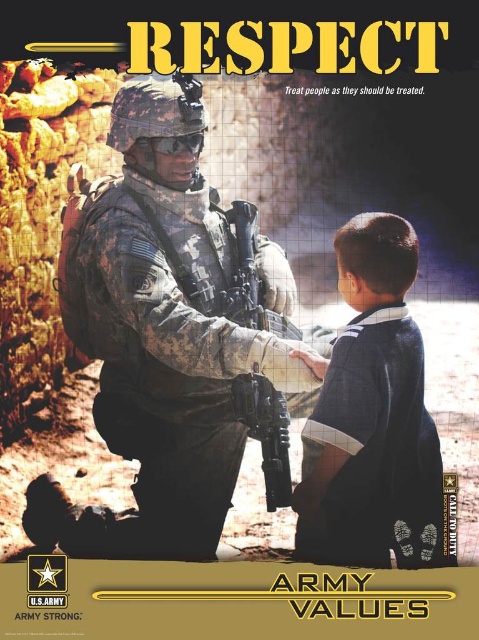
You are a designer creating a layout for a poster. You need to ensure that the camouflage uniform at center and the matte black rifle at center are placed in a way that the rifle doesn not block the uniform. Can you arrange them so that the rifle is positioned to the side of the uniform without overlapping?

The camouflage uniform at center might be wider than matte black rifle at center, so positioning the rifle to the side of the uniform could work, but you need to ensure there is enough space between them to prevent overlap. Since the uniform is wider, placing the rifle either to the left or right side of the uniform while maintaining a slight distance should keep both elements visible without obstruction.

You are designing a poster for the U.S. Army and need to ensure that the dark blue shirt at right and the matte black rifle at center are placed appropriately. Based on their sizes, which object should be positioned closer to the central theme to maintain visual balance?

The dark blue shirt at right occupies less space than the matte black rifle at center, so the smaller dark blue shirt at right should be placed closer to the central theme to balance the visual weight with the larger matte black rifle at center.